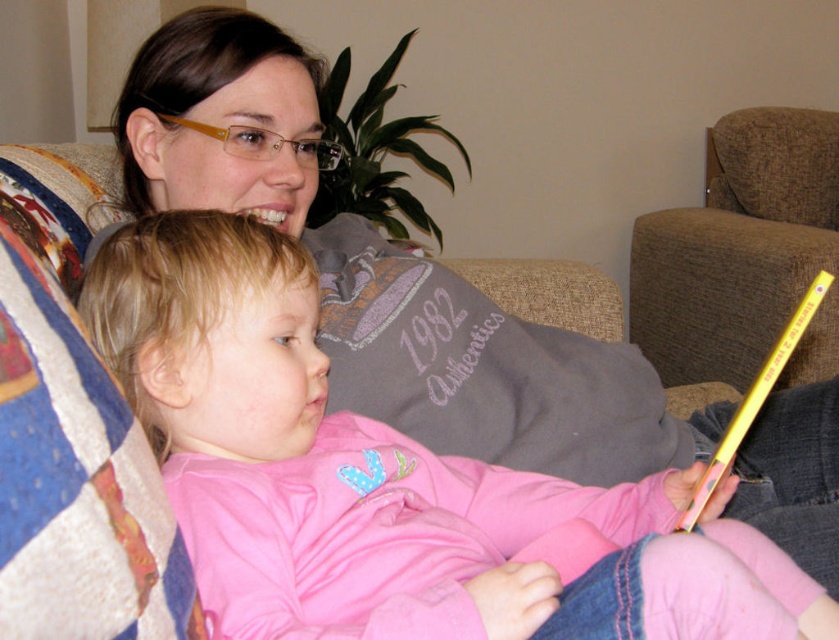
Is pink fleece sweater at center positioned at the back of brown fabric armchair at upper right?

No, pink fleece sweater at center is closer to the viewer.

Can you confirm if pink fleece sweater at center is thinner than brown fabric armchair at upper right?

No, pink fleece sweater at center is not thinner than brown fabric armchair at upper right.

Does point (236, 579) come in front of point (740, 179)?

Yes, point (236, 579) is in front of point (740, 179).

Locate an element on the screen. This screenshot has height=640, width=839. pink fleece sweater at center is located at coordinates (388, 481).